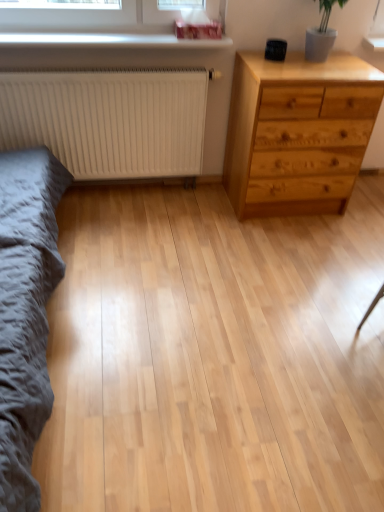
Where is `vacant area situated below white matte radiator at left (from a real-world perspective)`? vacant area situated below white matte radiator at left (from a real-world perspective) is located at coordinates (133, 190).